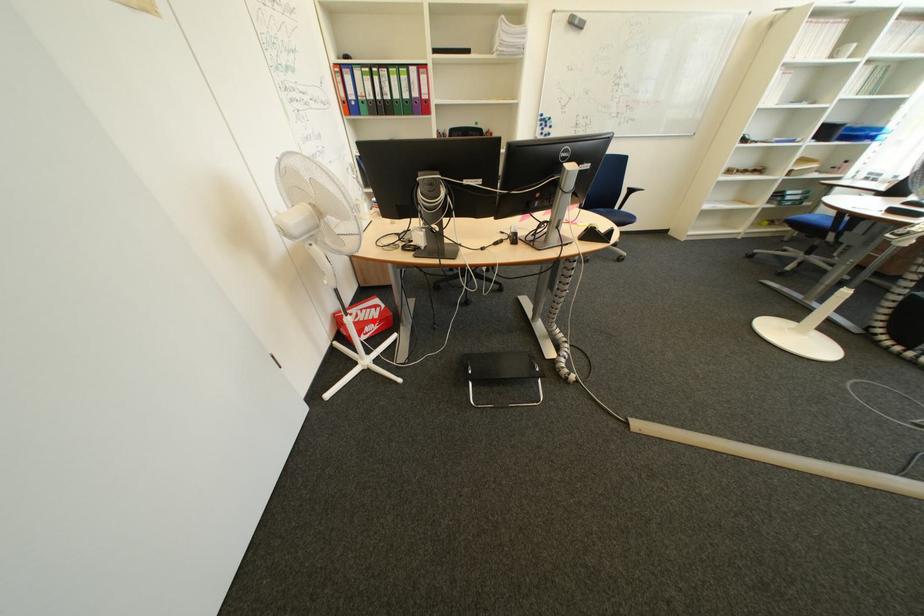
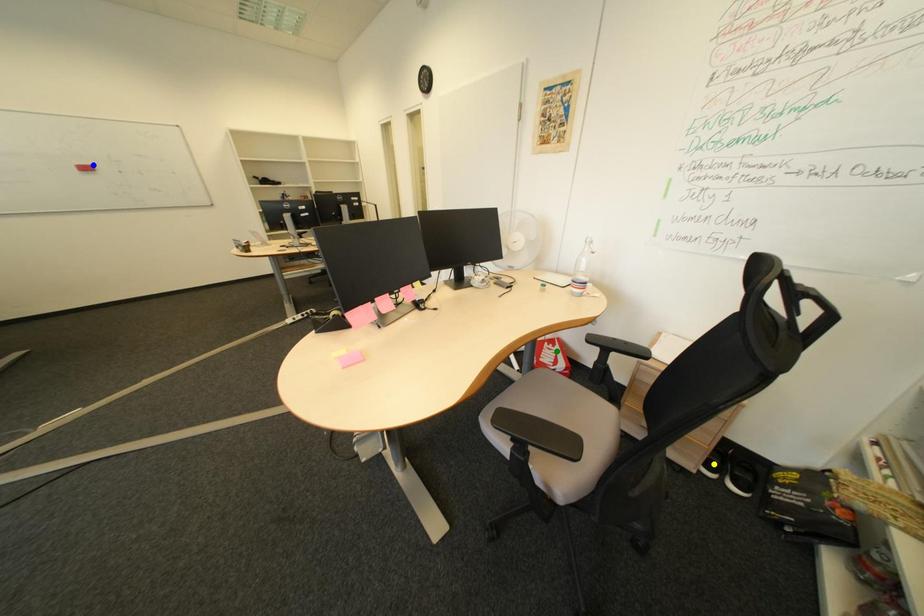
Question: I am providing you with two images of the same scene from different viewpoints. A red point is marked on the first image. You are given multiple points on the second image. In image 2, which mark is for the same physical point as the one in image 1?

Choices:
 (A) blue point
 (B) green point
 (C) yellow point

Answer: (B)